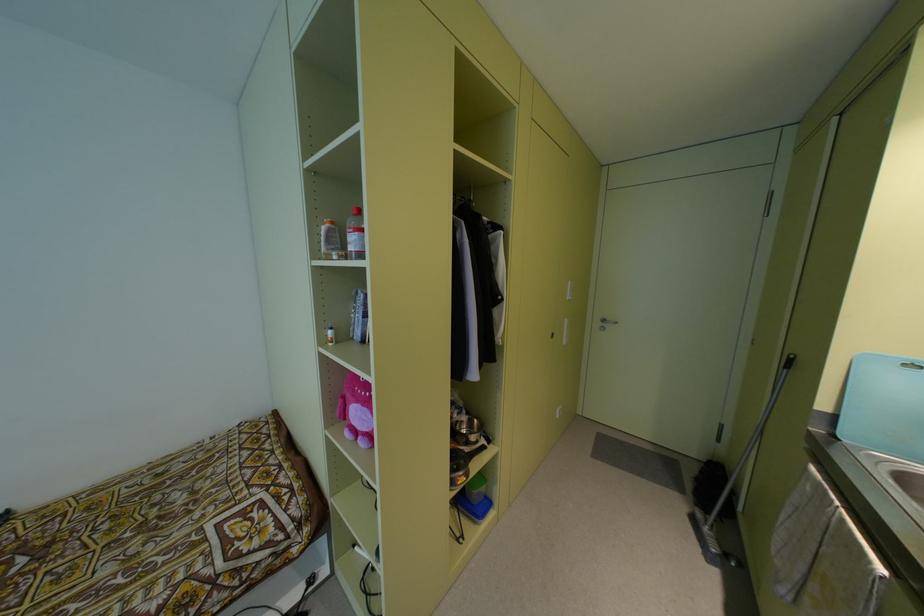
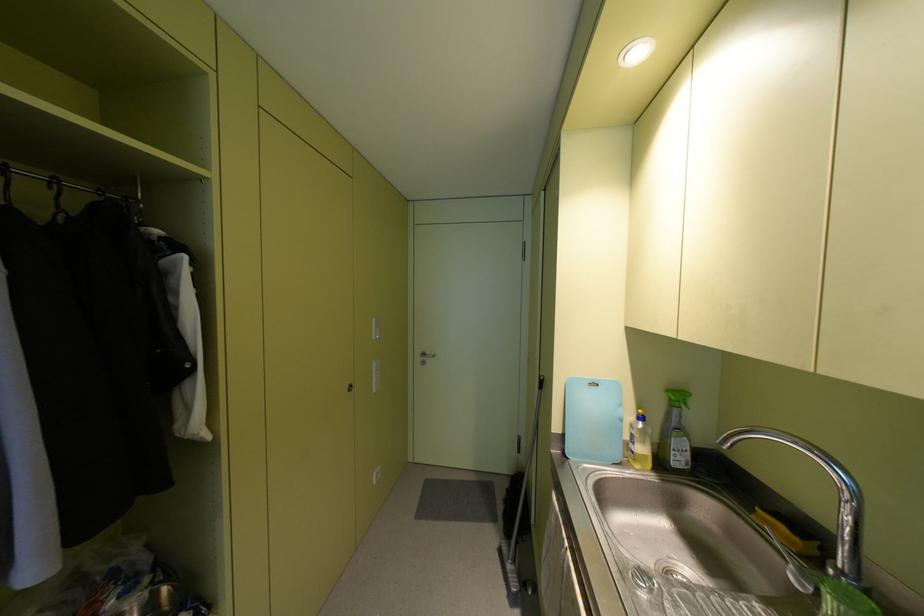
The point at [552,337] is marked in the first image. Where is the corresponding point in the second image?

(348, 390)